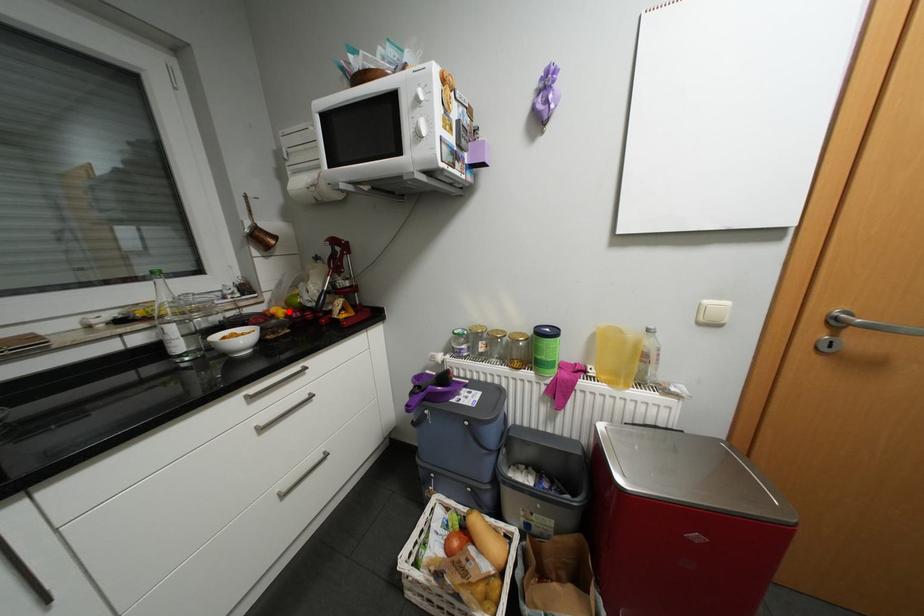
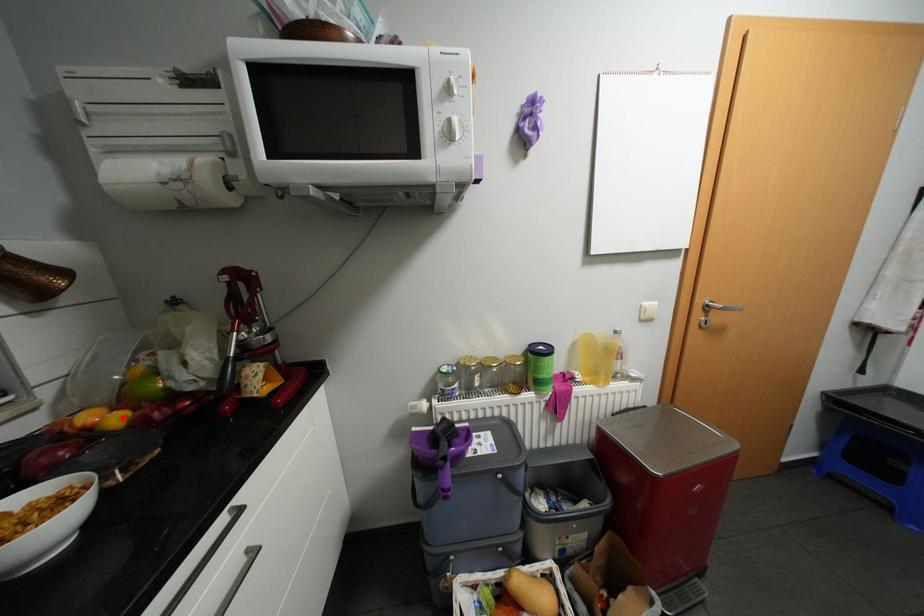
I am providing you with two images of the same scene from different viewpoints. A red point is marked on the first image and another point is marked on the second image. Is the marked point in image1 the same physical position as the marked point in image2?

Yes